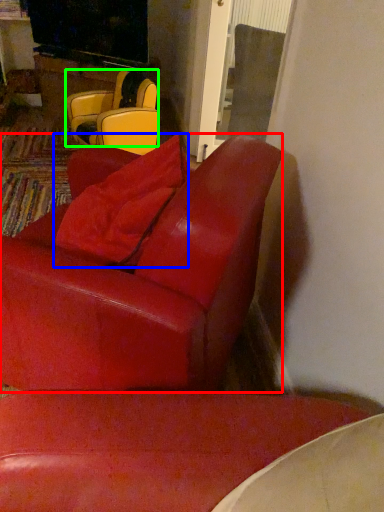
Question: Estimate the real-world distances between objects in this image. Which object is closer to chair (highlighted by a red box), pillow (highlighted by a blue box) or chair (highlighted by a green box)?

Choices:
 (A) pillow
 (B) chair

Answer: (A)